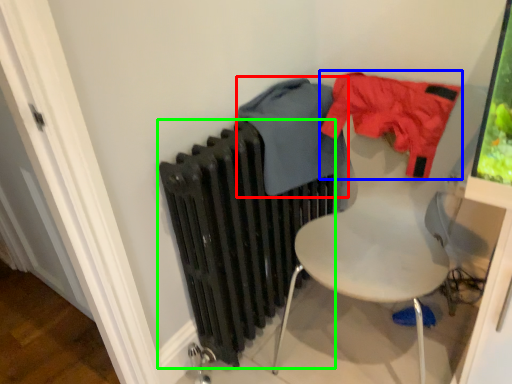
Question: Estimate the real-world distances between objects in this image. Which object is farther from clothing (highlighted by a red box), clothing (highlighted by a blue box) or radiator (highlighted by a green box)?

Choices:
 (A) clothing
 (B) radiator

Answer: (B)